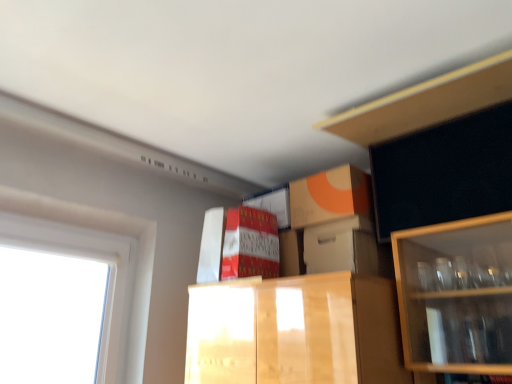
Question: Is wooden cabinet at upper right at the back of matte cardboard box at center?

Choices:
 (A) no
 (B) yes

Answer: (A)

Question: From the image's perspective, is matte cardboard box at center above wooden cabinet at upper right?

Choices:
 (A) yes
 (B) no

Answer: (B)

Question: Is matte cardboard box at center outside of wooden cabinet at upper right?

Choices:
 (A) yes
 (B) no

Answer: (A)

Question: From a real-world perspective, is matte cardboard box at center over wooden cabinet at upper right?

Choices:
 (A) no
 (B) yes

Answer: (A)

Question: Considering the relative sizes of matte cardboard box at center and wooden cabinet at upper right in the image provided, is matte cardboard box at center taller than wooden cabinet at upper right?

Choices:
 (A) no
 (B) yes

Answer: (B)

Question: From a real-world perspective, relative to matte cardboard box at center, is white plastic window at left vertically above or below?

Choices:
 (A) below
 (B) above

Answer: (A)

Question: From the image's perspective, relative to matte cardboard box at center, is white plastic window at left above or below?

Choices:
 (A) below
 (B) above

Answer: (A)

Question: Looking at their shapes, would you say white plastic window at left is wider or thinner than matte cardboard box at center?

Choices:
 (A) thin
 (B) wide

Answer: (A)

Question: Considering the relative positions of white plastic window at left and matte cardboard box at center in the image provided, is white plastic window at left to the left or to the right of matte cardboard box at center?

Choices:
 (A) left
 (B) right

Answer: (A)

Question: From a real-world perspective, is white cardboard box at center positioned above or below matte cardboard box at center?

Choices:
 (A) above
 (B) below

Answer: (B)

Question: Is white cardboard box at center wider or thinner than matte cardboard box at center?

Choices:
 (A) thin
 (B) wide

Answer: (A)

Question: Is point (306, 236) positioned closer to the camera than point (266, 271)?

Choices:
 (A) closer
 (B) farther

Answer: (B)

Question: From their relative heights in the image, would you say white cardboard box at center is taller or shorter than matte cardboard box at center?

Choices:
 (A) short
 (B) tall

Answer: (A)

Question: Is matte cardboard box at center wider or thinner than white plastic window at left?

Choices:
 (A) wide
 (B) thin

Answer: (A)

Question: Is matte cardboard box at center bigger or smaller than white plastic window at left?

Choices:
 (A) small
 (B) big

Answer: (A)